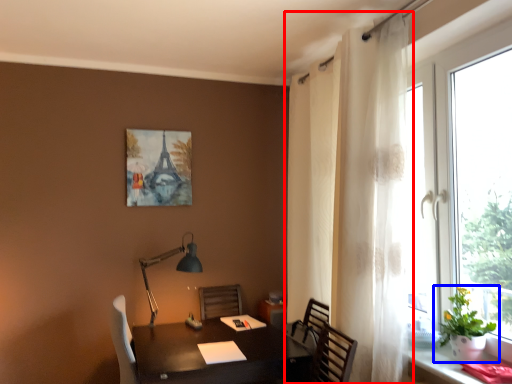
Question: Which object appears farthest to the camera in this image, curtain (highlighted by a red box) or houseplant (highlighted by a blue box)?

Choices:
 (A) curtain
 (B) houseplant

Answer: (A)